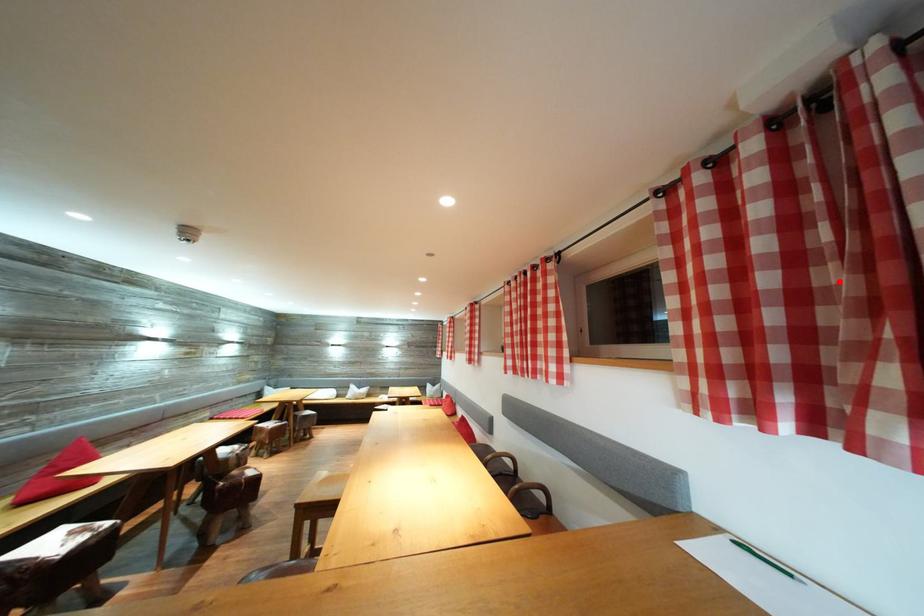
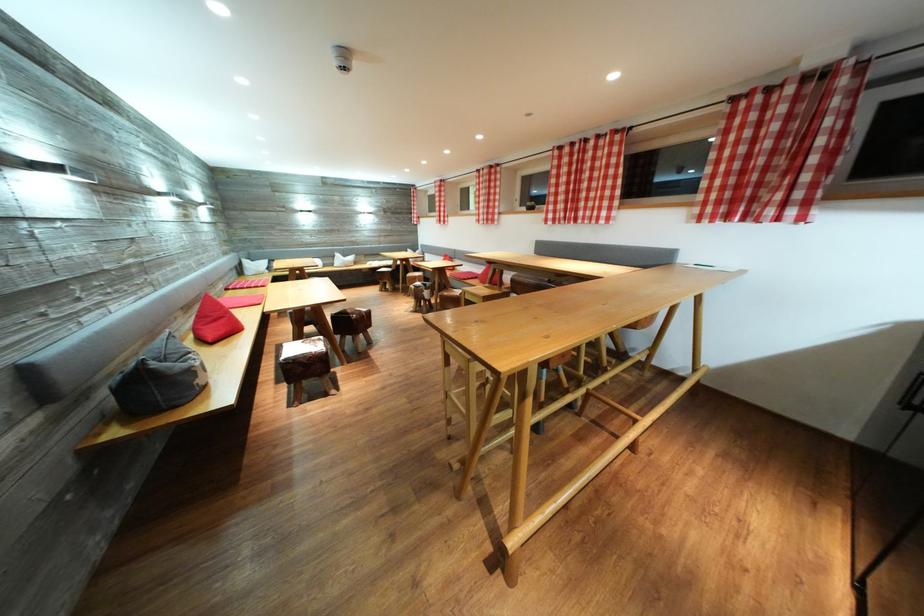
Where in the second image is the point corresponding to the highlighted location from the first image?

(787, 167)